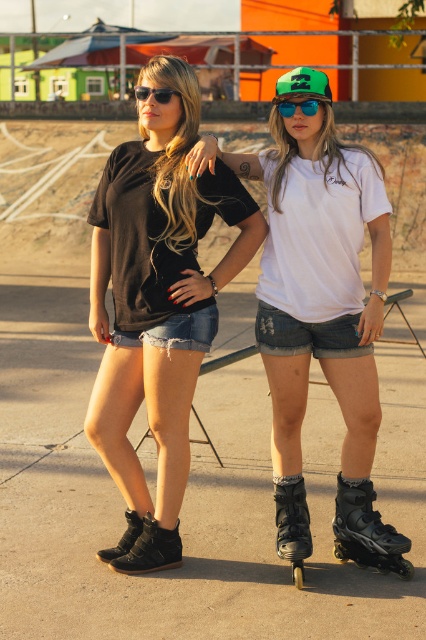
You are designing a display case for a boutique store. The case has two compartments side by side. The left compartment is 12 inches wide, and the right compartment is 8 inches wide. You need to place the black suede booties at center and the blue reflective lens goggles at center in the case. Which object should go in which compartment to fit properly?

The black suede booties at center should go in the left compartment which is 12 inches wide, and the blue reflective lens goggles at center should go in the right compartment which is 8 inches wide. This arrangement works because the black suede booties at center are wider than the blue reflective lens goggles at center, matching the compartments accordingly.